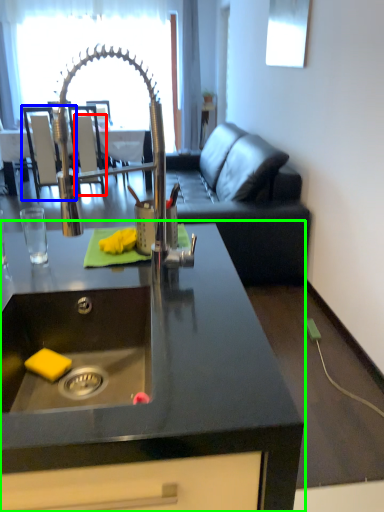
Question: Considering the real-world distances, which object is closest to armchair (highlighted by a red box)? armchair (highlighted by a blue box) or countertop (highlighted by a green box).

Choices:
 (A) armchair
 (B) countertop

Answer: (A)